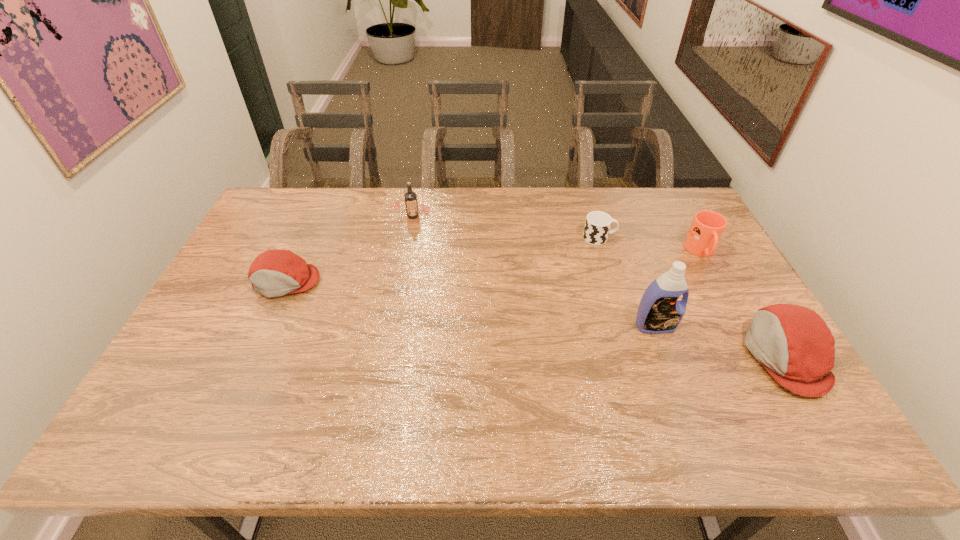
To achieve uniform spacing by inserting another cap_(headwear) among them, please point to a free space for this new cap_(headwear). Please provide its 2D coordinates. Your answer should be formatted as a tuple, i.e. [(x, y)], where the tuple contains the x and y coordinates of a point satisfying the conditions above.

[(516, 316)]